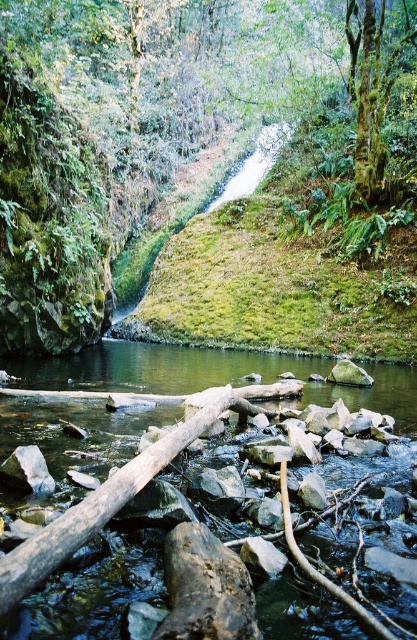
Measure the distance from smooth brown river at center to gray rock at center.

smooth brown river at center and gray rock at center are 4.16 meters apart.

Is point (409, 605) positioned before point (336, 378)?

That is True.

Is point (409, 524) farther from viewer compared to point (339, 376)?

No, it is not.

Image resolution: width=417 pixels, height=640 pixels. In order to click on smooth brown river at center in this screenshot , I will do click(140, 548).

I want to click on white smooth rock at center, so click(x=27, y=470).

Who is positioned more to the right, white smooth rock at center or gray rock at center?

From the viewer's perspective, gray rock at center appears more on the right side.

Locate an element on the screen. The height and width of the screenshot is (640, 417). white smooth rock at center is located at coordinates (27, 470).

Image resolution: width=417 pixels, height=640 pixels. In order to click on white smooth rock at center in this screenshot , I will do `click(27, 470)`.

Between smooth brown river at center and white smooth rock at center, which one appears on the left side from the viewer's perspective?

Positioned to the left is white smooth rock at center.

Does smooth brown river at center have a lesser height compared to white smooth rock at center?

In fact, smooth brown river at center may be taller than white smooth rock at center.

What do you see at coordinates (140, 548) in the screenshot? The height and width of the screenshot is (640, 417). I see `smooth brown river at center` at bounding box center [140, 548].

The width and height of the screenshot is (417, 640). Find the location of `smooth brown river at center`. smooth brown river at center is located at coordinates (140, 548).